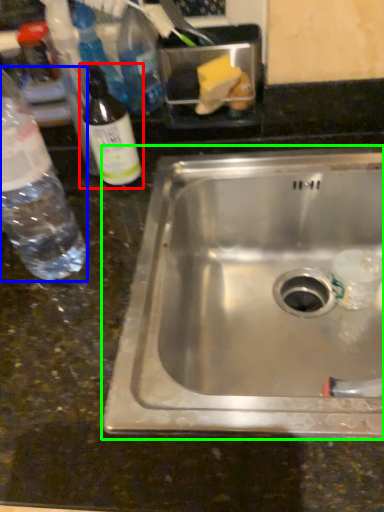
Question: Which object is the closest to the bottle (highlighted by a red box)? Choose among these: bottle (highlighted by a blue box) or sink (highlighted by a green box).

Choices:
 (A) bottle
 (B) sink

Answer: (A)